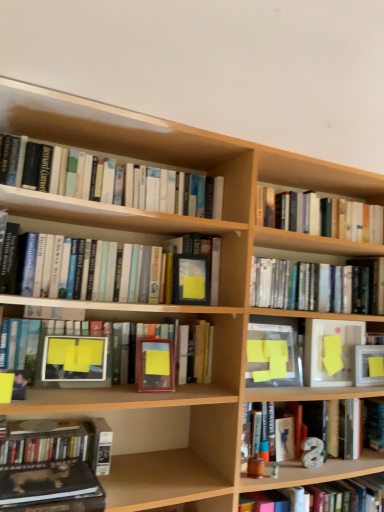
What are the coordinates of `yellow matte paper at center, the second paperback book when ordered from left to right` in the screenshot? It's located at (272, 356).

Locate an element on the screen. The image size is (384, 512). matte yellow picture frame at center-left, acting as the 2th picture frame starting from the right is located at coordinates (74, 359).

The width and height of the screenshot is (384, 512). What are the coordinates of `hardcover book at lower left, the fifth book viewed from the top` in the screenshot? It's located at (52, 465).

The image size is (384, 512). What are the coordinates of `brown leather book at lower left, the sixth book positioned from the top` in the screenshot? It's located at (46, 482).

The height and width of the screenshot is (512, 384). What do you see at coordinates (46, 482) in the screenshot? I see `brown leather book at lower left, the sixth book positioned from the top` at bounding box center [46, 482].

Locate an element on the screen. The width and height of the screenshot is (384, 512). yellow matte paper at center, positioned as the 2th paperback book in right-to-left order is located at coordinates (272, 356).

Locate an element on the screen. This screenshot has width=384, height=512. the 2nd paperback book to the left when counting from the hardcover books at center right, the 5th book positioned from the bottom is located at coordinates 191,279.

In the scene shown: Can hardcover books at center right, which appears as the third book when viewed from the top, be found inside matte black book at center, the third paperback book viewed from the right?

No, matte black book at center, the third paperback book viewed from the right, does not contain hardcover books at center right, which appears as the third book when viewed from the top.

Can you confirm if matte black book at center, the third paperback book viewed from the right, is smaller than hardcover books at center right, which appears as the third book when viewed from the top?

Correct, matte black book at center, the third paperback book viewed from the right, occupies less space than hardcover books at center right, which appears as the third book when viewed from the top.

How many degrees apart are the facing directions of matte black book at center, the third paperback book viewed from the right, and hardcover books at center right, the 5th book positioned from the bottom?

There is a 3.81-degree angle between the facing directions of matte black book at center, the third paperback book viewed from the right, and hardcover books at center right, the 5th book positioned from the bottom.

From the image's perspective, would you say hardcover books at center right, the 5th book positioned from the bottom, is shown under hardcover books at upper right, which ranks as the 7th book in bottom-to-top order?

Correct, hardcover books at center right, the 5th book positioned from the bottom, appears lower than hardcover books at upper right, which ranks as the 7th book in bottom-to-top order, in the image.

Considering the relative sizes of hardcover books at center right, the 5th book positioned from the bottom, and hardcover books at upper right, which ranks as the 7th book in bottom-to-top order, in the image provided, is hardcover books at center right, the 5th book positioned from the bottom, bigger than hardcover books at upper right, which ranks as the 7th book in bottom-to-top order,?

Correct, hardcover books at center right, the 5th book positioned from the bottom, is larger in size than hardcover books at upper right, which ranks as the 7th book in bottom-to-top order.

Considering their positions, is hardcover books at center right, the 5th book positioned from the bottom, located in front of or behind hardcover books at upper right, which ranks as the 7th book in bottom-to-top order?

In the image, hardcover books at center right, the 5th book positioned from the bottom, appears in front of hardcover books at upper right, which ranks as the 7th book in bottom-to-top order.

In the scene shown: Is hardcover books at center right, the 5th book positioned from the bottom, wider or thinner than hardcover books at upper right, positioned as the first book in top-to-bottom order?

In the image, hardcover books at center right, the 5th book positioned from the bottom, appears to be wider than hardcover books at upper right, positioned as the first book in top-to-bottom order.

Which object is thinner, hardcover book at center, which appears as the fourth book when viewed from the top, or hardcover book at center, which appears as the 2th book when viewed from the top?

Thinner between the two is hardcover book at center, which appears as the fourth book when viewed from the top.

From the image's perspective, would you say hardcover book at center, which appears as the fourth book when viewed from the top, is shown under hardcover book at center, which is the 6th book in bottom-to-top order?

Yes.

Which object is positioned more to the left, hardcover book at center, which appears as the fourth book when viewed from the top, or hardcover book at center, which is the 6th book in bottom-to-top order?

From the viewer's perspective, hardcover book at center, which appears as the fourth book when viewed from the top, appears more on the left side.

Is hardcover book at center, which appears as the fourth book when viewed from the top, positioned beyond the bounds of hardcover book at center, which is the 6th book in bottom-to-top order?

Indeed, hardcover book at center, which appears as the fourth book when viewed from the top, is completely outside hardcover book at center, which is the 6th book in bottom-to-top order.

Does point (71, 357) come closer to viewer compared to point (365, 454)?

Yes, point (71, 357) is in front of point (365, 454).

Find the location of a particular element. the 2nd picture frame in front of the white glossy letter at center-right, the seventh book positioned from the top, starting your count from the anchor is located at coordinates (74, 359).

Is matte yellow picture frame at center-left, acting as the 2th picture frame starting from the right, inside or outside of white glossy letter at center-right, the first book from the bottom?

matte yellow picture frame at center-left, acting as the 2th picture frame starting from the right, is spatially situated outside white glossy letter at center-right, the first book from the bottom.

Is matte yellow picture frame at center-left, which ranks as the 1th picture frame in left-to-right order, in front of white glossy letter at center-right, the first book from the bottom?

Yes, matte yellow picture frame at center-left, which ranks as the 1th picture frame in left-to-right order, is in front of white glossy letter at center-right, the first book from the bottom.

Which point is more distant from viewer, (68, 482) or (36, 234)?

The point (36, 234) is farther.

From a real-world perspective, does hardcover book at lower left, the fifth book viewed from the top, sit lower than hardcover book at center, which appears as the 2th book when viewed from the top?

Correct, in the physical world, hardcover book at lower left, the fifth book viewed from the top, is lower than hardcover book at center, which appears as the 2th book when viewed from the top.

Is hardcover book at lower left, marked as the third book in a bottom-to-top arrangement, in front of hardcover book at center, which is the 6th book in bottom-to-top order?

That is True.

Which is correct: white glossy letter at center-right, the first book from the bottom, is inside hardcover books at upper right, positioned as the first book in top-to-bottom order, or outside of it?

white glossy letter at center-right, the first book from the bottom, is spatially situated outside hardcover books at upper right, positioned as the first book in top-to-bottom order.

From a real-world perspective, is white glossy letter at center-right, the seventh book positioned from the top, physically located above or below hardcover books at upper right, which ranks as the 7th book in bottom-to-top order?

Clearly, from a real-world perspective, white glossy letter at center-right, the seventh book positioned from the top, is below hardcover books at upper right, which ranks as the 7th book in bottom-to-top order.

Measure the distance between white glossy letter at center-right, the seventh book positioned from the top, and hardcover books at upper right, positioned as the first book in top-to-bottom order.

white glossy letter at center-right, the seventh book positioned from the top, and hardcover books at upper right, positioned as the first book in top-to-bottom order, are 36.24 inches apart.

Considering the sizes of objects white glossy letter at center-right, the seventh book positioned from the top, and hardcover books at upper right, positioned as the first book in top-to-bottom order, in the image provided, who is wider, white glossy letter at center-right, the seventh book positioned from the top, or hardcover books at upper right, positioned as the first book in top-to-bottom order,?

white glossy letter at center-right, the seventh book positioned from the top.

Which object is positioned more to the left, hardcover book at lower left, the fifth book viewed from the top, or hardcover books at upper right, which ranks as the 7th book in bottom-to-top order?

hardcover book at lower left, the fifth book viewed from the top.

From the image's perspective, is hardcover book at lower left, the fifth book viewed from the top, positioned above or below hardcover books at upper right, positioned as the first book in top-to-bottom order?

From the image's perspective, hardcover book at lower left, the fifth book viewed from the top, appears below hardcover books at upper right, positioned as the first book in top-to-bottom order.

Locate an element on the screen. book that is the 1st one when counting downward from the matte black book at center, which ranks as the 1th paperback book in left-to-right order (from the image's perspective) is located at coordinates (309, 286).

This screenshot has height=512, width=384. Identify the location of book that is behind the hardcover books at center right, the 5th book positioned from the bottom. (329, 217).

Which object lies further to the anchor point hardcover books at upper right, positioned as the first book in top-to-bottom order, matte yellow paper at center right, the 1th paperback book in the right-to-left sequence, or brown leather book at lower left, which ranks as the second book in bottom-to-top order?

Among the two, brown leather book at lower left, which ranks as the second book in bottom-to-top order, is located further to hardcover books at upper right, positioned as the first book in top-to-bottom order.

Looking at the image, which one is located further to matte black book at center, which ranks as the 1th paperback book in left-to-right order, matte yellow picture frame at center-left, which ranks as the 1th picture frame in left-to-right order, or yellow matte paper at center, positioned as the 2th paperback book in right-to-left order?

matte yellow picture frame at center-left, which ranks as the 1th picture frame in left-to-right order, is positioned further to the anchor matte black book at center, which ranks as the 1th paperback book in left-to-right order.

Looking at the image, which one is located closer to yellow matte paper at center, positioned as the 2th paperback book in right-to-left order, matte yellow picture frame at center-left, acting as the 2th picture frame starting from the right, or hardcover books at center right, which appears as the third book when viewed from the top?

The object closer to yellow matte paper at center, positioned as the 2th paperback book in right-to-left order, is hardcover books at center right, which appears as the third book when viewed from the top.

Looking at the image, which one is located further to hardcover books at upper right, which ranks as the 7th book in bottom-to-top order, hardcover book at lower left, the fifth book viewed from the top, or matte yellow picture frame at center-left, acting as the 2th picture frame starting from the right?

hardcover book at lower left, the fifth book viewed from the top.

When comparing their distances from matte yellow picture frame at center-left, which ranks as the 1th picture frame in left-to-right order, does brown leather book at lower left, the sixth book positioned from the top, or hardcover book at center, which appears as the fourth book when viewed from the top, seem further?

Among the two, brown leather book at lower left, the sixth book positioned from the top, is located further to matte yellow picture frame at center-left, which ranks as the 1th picture frame in left-to-right order.

Which object lies nearer to the anchor point hardcover books at upper right, positioned as the first book in top-to-bottom order, hardcover book at center, which is the 6th book in bottom-to-top order, or hardcover book at center, which appears as the fourth book when viewed from the top?

hardcover book at center, which is the 6th book in bottom-to-top order.

Looking at the image, which one is located closer to matte yellow picture frame at center-left, which ranks as the 1th picture frame in left-to-right order, yellow matte paper at center, the second paperback book when ordered from left to right, or matte black book at center, the third paperback book viewed from the right?

The object closer to matte yellow picture frame at center-left, which ranks as the 1th picture frame in left-to-right order, is matte black book at center, the third paperback book viewed from the right.

When comparing their distances from white glossy letter at center-right, the seventh book positioned from the top, does matte yellow picture frame at center-left, acting as the 2th picture frame starting from the right, or hardcover book at center, which is the fourth book in bottom-to-top order, seem closer?

hardcover book at center, which is the fourth book in bottom-to-top order.

At what (x,y) coordinates should I click in order to perform the action: click on picture frame between matte yellow picture frame at center-left, which ranks as the 1th picture frame in left-to-right order, and matte yellow paper at center right, the 1th paperback book in the right-to-left sequence, in the horizontal direction. Please return your answer as a coordinate pair (x, y). This screenshot has height=512, width=384. Looking at the image, I should click on (155, 365).

Find the location of a particular element. The image size is (384, 512). picture frame between hardcover book at center, which appears as the fourth book when viewed from the top, and matte yellow paper at center right, the third paperback book in the left-to-right sequence, in the horizontal direction is located at coordinates (155, 365).

The image size is (384, 512). In order to click on picture frame situated between hardcover book at center, which is the fourth book in bottom-to-top order, and yellow matte paper at center, the second paperback book when ordered from left to right, from left to right in this screenshot , I will do `click(155, 365)`.

This screenshot has width=384, height=512. What are the coordinates of `picture frame located between hardcover book at center, which is the 6th book in bottom-to-top order, and hardcover books at upper right, which ranks as the 7th book in bottom-to-top order, in the left-right direction` in the screenshot? It's located at (155, 365).